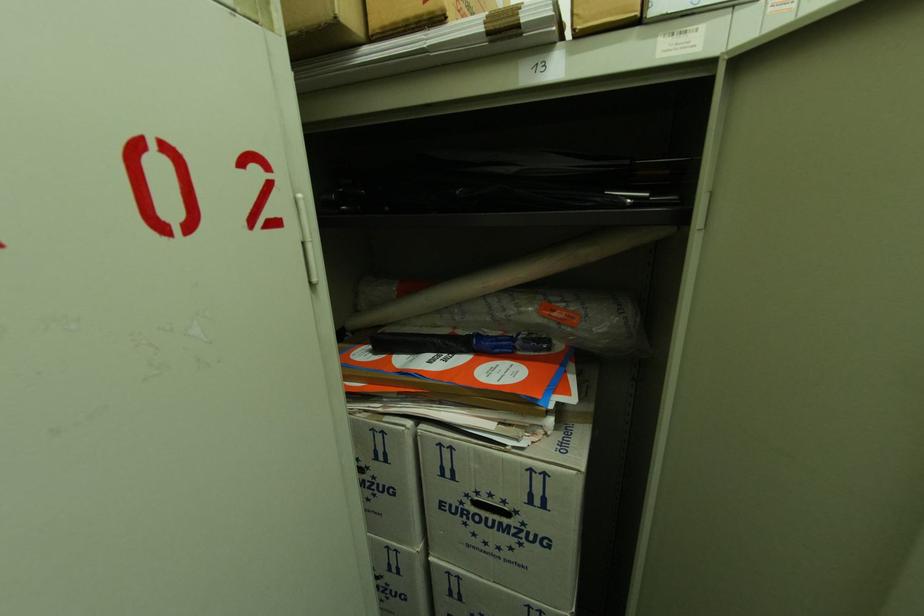
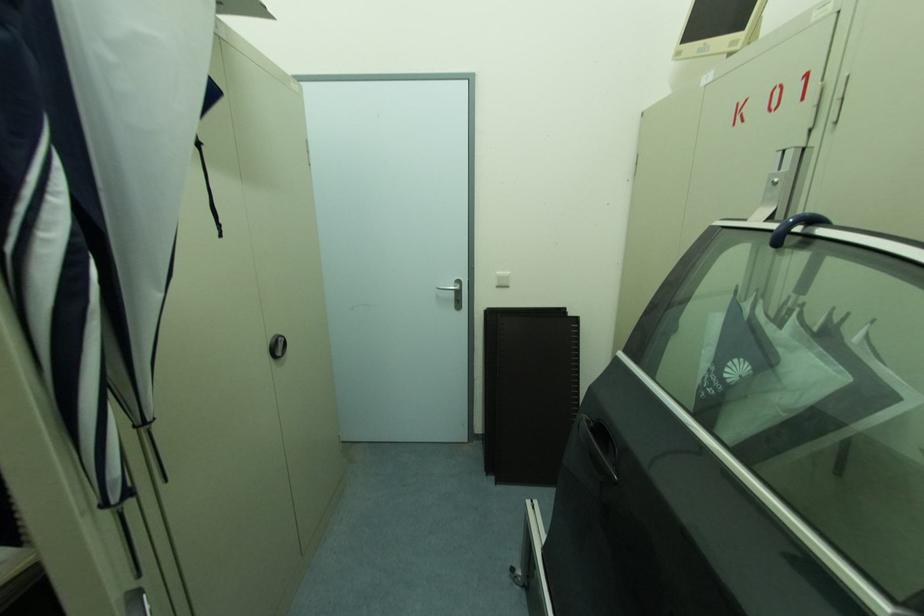
Looking at this image, the images are taken continuously from a first-person perspective. In which direction is your viewpoint rotating?

The camera's rotation is toward right-down.